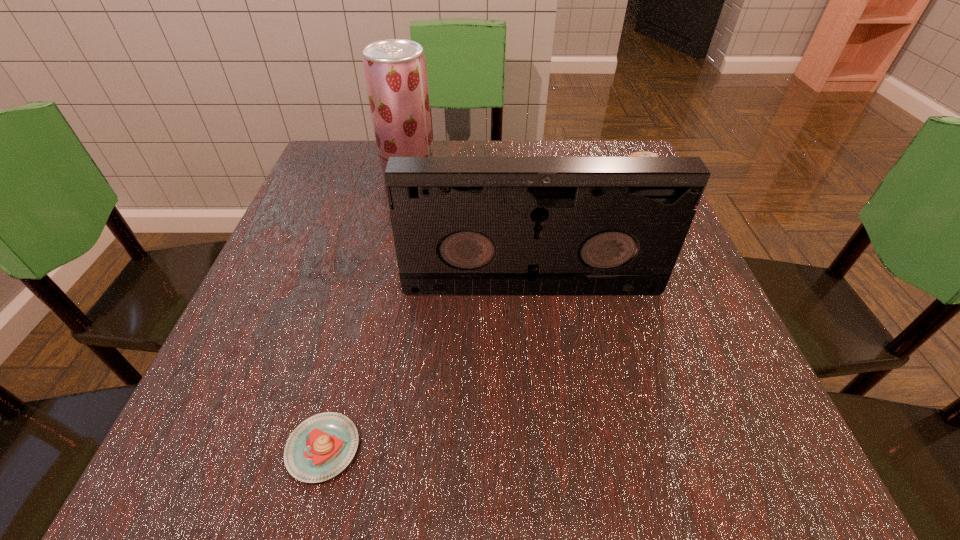
Where is `the tallest object`? the tallest object is located at coordinates (395, 70).

The image size is (960, 540). Identify the location of the second tallest object. (461, 225).

Where is `the third farthest object`? the third farthest object is located at coordinates (461, 225).

Locate an element on the screen. This screenshot has width=960, height=540. the farther pastry is located at coordinates (638, 154).

Identify the location of the taller pastry. Image resolution: width=960 pixels, height=540 pixels. (638, 154).

The height and width of the screenshot is (540, 960). Find the location of `the shortest object`. the shortest object is located at coordinates (322, 446).

The image size is (960, 540). What are the coordinates of `the nearer pastry` in the screenshot? It's located at (322, 446).

Find the location of a particular element. This screenshot has height=540, width=960. vacant space situated on the right of the tallest object is located at coordinates (564, 191).

This screenshot has width=960, height=540. Find the location of `vacant space positioned on the front side of the third shortest object`. vacant space positioned on the front side of the third shortest object is located at coordinates (543, 390).

Locate an element on the screen. This screenshot has width=960, height=540. free space located on the front of the right pastry is located at coordinates (687, 319).